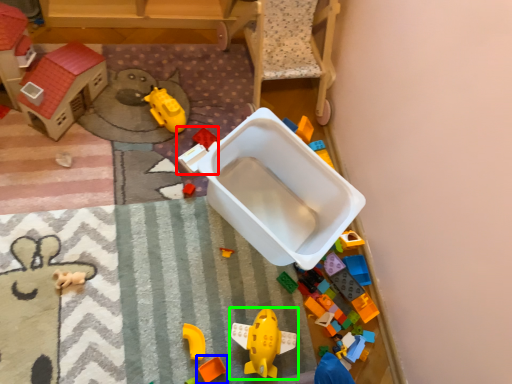
Question: Considering the real-world distances, which object is closest to toy (highlighted by a red box)? toy (highlighted by a blue box) or toy (highlighted by a green box).

Choices:
 (A) toy
 (B) toy

Answer: (B)